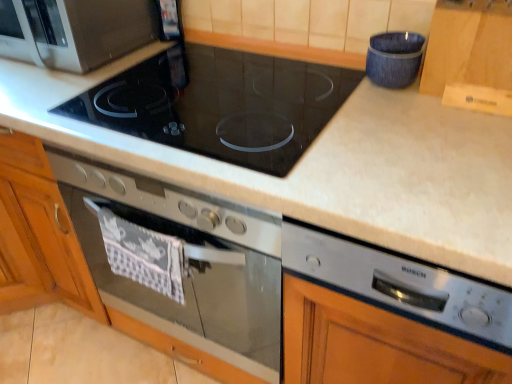
Question: Can you see satin silver oven at center touching black glass cooktop at center?

Choices:
 (A) yes
 (B) no

Answer: (B)

Question: Does satin silver oven at center turn towards black glass cooktop at center?

Choices:
 (A) yes
 (B) no

Answer: (B)

Question: Does satin silver oven at center appear on the left side of black glass cooktop at center?

Choices:
 (A) yes
 (B) no

Answer: (A)

Question: Is satin silver oven at center positioned behind black glass cooktop at center?

Choices:
 (A) no
 (B) yes

Answer: (A)

Question: Considering the relative sizes of satin silver oven at center and black glass cooktop at center in the image provided, is satin silver oven at center wider than black glass cooktop at center?

Choices:
 (A) no
 (B) yes

Answer: (A)

Question: Does satin silver oven at center have a lesser height compared to black glass cooktop at center?

Choices:
 (A) yes
 (B) no

Answer: (B)

Question: Is matte black microwave at upper left shorter than blue textured fabric at upper right, the first appliance from the back?

Choices:
 (A) no
 (B) yes

Answer: (A)

Question: Is matte black microwave at upper left thinner than blue textured fabric at upper right, which is counted as the second appliance, starting from the front?

Choices:
 (A) yes
 (B) no

Answer: (B)

Question: Is the position of matte black microwave at upper left less distant than that of blue textured fabric at upper right, positioned as the second appliance in bottom-to-top order?

Choices:
 (A) no
 (B) yes

Answer: (A)

Question: From a real-world perspective, is matte black microwave at upper left positioned under blue textured fabric at upper right, marked as the first appliance in a top-to-bottom arrangement, based on gravity?

Choices:
 (A) yes
 (B) no

Answer: (B)

Question: Considering the relative sizes of matte black microwave at upper left and blue textured fabric at upper right, positioned as the second appliance in bottom-to-top order, in the image provided, is matte black microwave at upper left bigger than blue textured fabric at upper right, positioned as the second appliance in bottom-to-top order,?

Choices:
 (A) no
 (B) yes

Answer: (B)

Question: From the image's perspective, is matte black microwave at upper left beneath blue textured fabric at upper right, marked as the first appliance in a top-to-bottom arrangement?

Choices:
 (A) yes
 (B) no

Answer: (B)

Question: Is blue textured fabric at upper right, the first appliance from the back, closer to the viewer compared to matte black microwave at upper left?

Choices:
 (A) yes
 (B) no

Answer: (A)